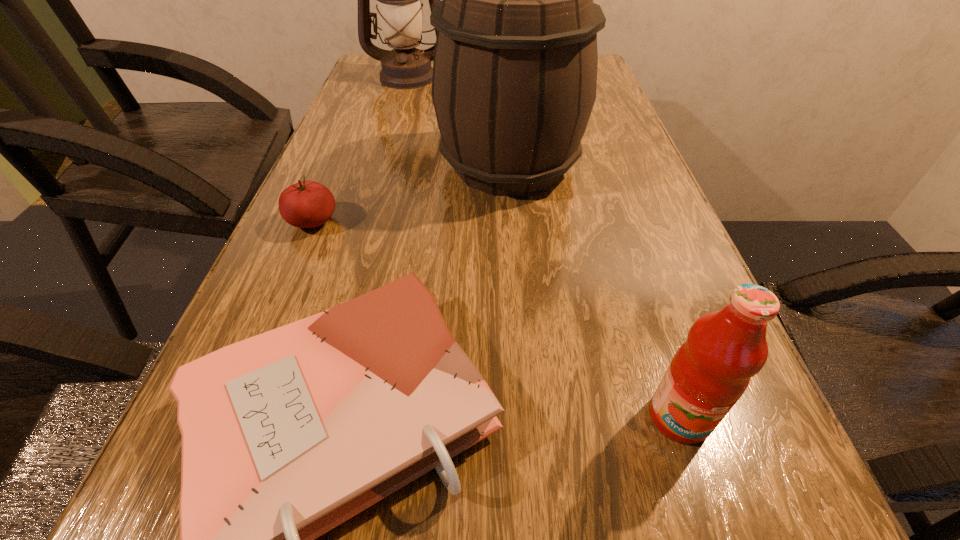
You are a GUI agent. You are given a task and a screenshot of the screen. Output one action in this format:
    pyautogui.click(x=<x>, y=<y>)
    Task: Click on the oil lamp
    This screenshot has width=960, height=540.
    Given the screenshot: What is the action you would take?
    pyautogui.click(x=399, y=8)

At what (x,y) coordinates should I click in order to perform the action: click on wine bucket. Please return your answer as a coordinate pair (x, y). Image resolution: width=960 pixels, height=540 pixels. Looking at the image, I should click on (514, 82).

Locate an element on the screen. The width and height of the screenshot is (960, 540). the third shortest object is located at coordinates (709, 373).

At what (x,y) coordinates should I click in order to perform the action: click on tomato. Please return your answer as a coordinate pair (x, y). The image size is (960, 540). Looking at the image, I should click on (306, 204).

At what (x,y) coordinates should I click in order to perform the action: click on vacant region located on the front of the farthest object. Please return your answer as a coordinate pair (x, y). Looking at the image, I should click on (394, 129).

Where is `vacant space positioned 0.280m on the left of the wine bucket`? Image resolution: width=960 pixels, height=540 pixels. vacant space positioned 0.280m on the left of the wine bucket is located at coordinates (316, 165).

Locate an element on the screen. The image size is (960, 540). free region located on the front label of the third shortest object is located at coordinates (703, 489).

I want to click on free space located 0.360m on the right of the tomato, so click(x=522, y=221).

In order to click on object that is positioned at the far edge in this screenshot , I will do `click(399, 8)`.

Locate an element on the screen. This screenshot has height=540, width=960. oil lamp that is at the left edge is located at coordinates (399, 8).